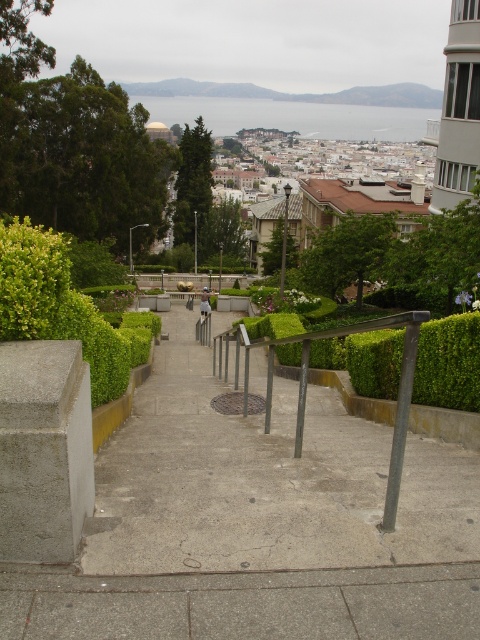
You are a delivery person carrying a heavy package and need to place it somewhere on the scene. The gray concrete pavement at center and the light brown wooden bench at center are both options. Which one is shorter and thus safer to place the package on?

The gray concrete pavement at center is not as tall as the light brown wooden bench at center, so it is shorter and safer to place the package there.

From the picture: You are standing at the top of the staircase and want to place a 10 feet long ladder between the metallic gray railing at center and the camera. Is there enough space?

The distance between the metallic gray railing at center and the camera is 9.57 feet, which is less than the ladder length of 10 feet. Therefore, the ladder cannot be placed there.

You are a painter standing at the bottom of the staircase and want to paint both the metallic gray railing at center and the light brown wooden stick at center. Which object should you look up to paint first?

The metallic gray railing at center has a greater height compared to the light brown wooden stick at center, so you should look up to paint the metallic gray railing at center first.